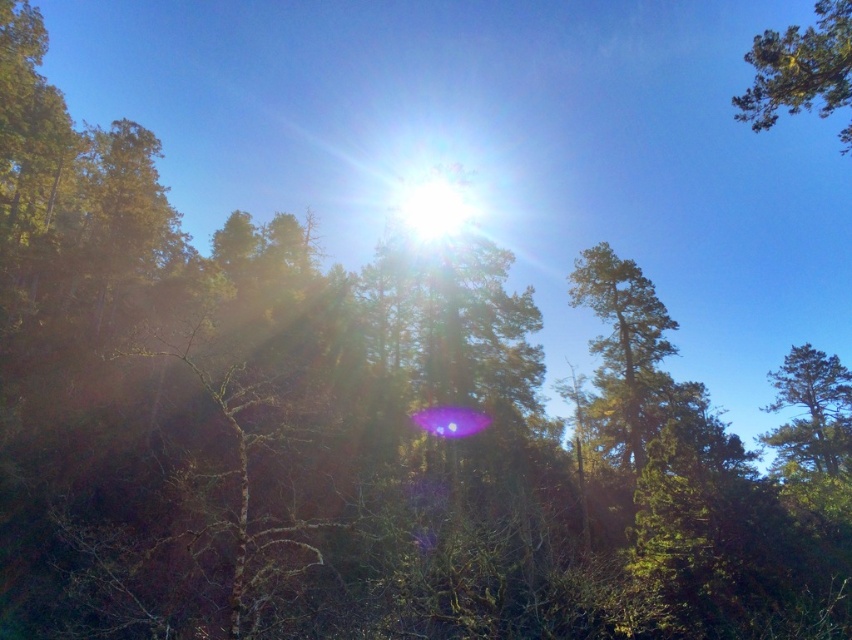
You are standing in the forest and want to take a photo of the green textured tree at upper right. If your camera has a maximum focus range of 15 meters, will it be able to focus on the tree?

The green textured tree at upper right is 14.91 meters away from the viewer, which is within the camera maximum focus range of 15 meters. Therefore, the camera can focus on the green textured tree at upper right.

You are a bird flying over the forest and want to land on the nearest tree. Which tree should you head towards, the green textured tree at upper right or the green leafy tree at right?

The green textured tree at upper right is to the left of the green leafy tree at right, so the green leafy tree at right is further to the right. Since you are flying over the forest, the nearest tree would depend on your current position. However, based on their positions, if you are approaching from the left side of the image, the green textured tree at upper right would be closer. If you are approaching from the right, the green leafy tree at right would be closer. Without knowing your exact location, it